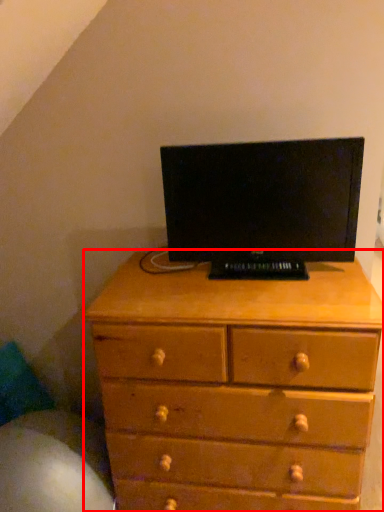
Question: In this image, where is chest of drawers (annotated by the red box) located relative to computer monitor?

Choices:
 (A) left
 (B) right

Answer: (A)